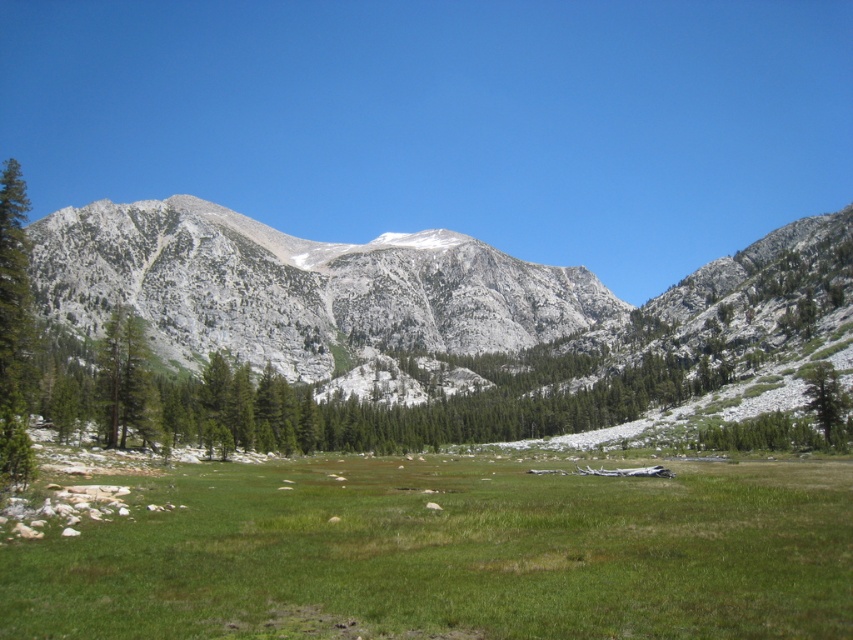
Question: Which object is the closest to the green textured tree at right?

Choices:
 (A) green grassy field at center
 (B) white rocky mountain at center

Answer: (A)

Question: Does green grassy field at center appear over green textured tree at right?

Choices:
 (A) no
 (B) yes

Answer: (A)

Question: Is green grassy field at center bigger than green textured tree at right?

Choices:
 (A) yes
 (B) no

Answer: (A)

Question: Considering the real-world distances, which object is farthest from the green grassy field at center?

Choices:
 (A) green textured tree at right
 (B) white rocky mountain at center

Answer: (B)

Question: Does green grassy field at center lie behind green textured tree at right?

Choices:
 (A) no
 (B) yes

Answer: (A)

Question: Which point appears farthest from the camera in this image?

Choices:
 (A) (746, 598)
 (B) (820, 420)
 (C) (345, 243)

Answer: (C)